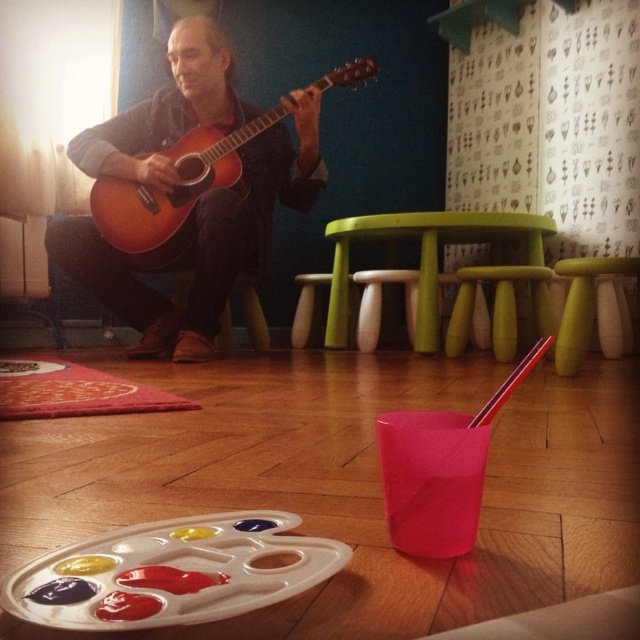
Question: Is matte brown guitar at center wider than green plastic stool at center?

Choices:
 (A) no
 (B) yes

Answer: (B)

Question: Based on their relative distances, which object is nearer to the matte brown guitar at center?

Choices:
 (A) matte brown acoustic guitar at center
 (B) yellow matte stool at center

Answer: (A)

Question: Based on their relative distances, which object is farther from the yellow matte stool at center?

Choices:
 (A) green plastic stool at center
 (B) matte brown guitar at center

Answer: (B)

Question: Is matte brown acoustic guitar at center smaller than yellow matte stool at center?

Choices:
 (A) no
 (B) yes

Answer: (A)

Question: Considering the relative positions of matte brown acoustic guitar at center and yellow matte stool at center in the image provided, where is matte brown acoustic guitar at center located with respect to yellow matte stool at center?

Choices:
 (A) above
 (B) below

Answer: (A)

Question: Which of the following is the closest to the observer?

Choices:
 (A) (518, 216)
 (B) (576, 353)
 (C) (208, 323)

Answer: (B)